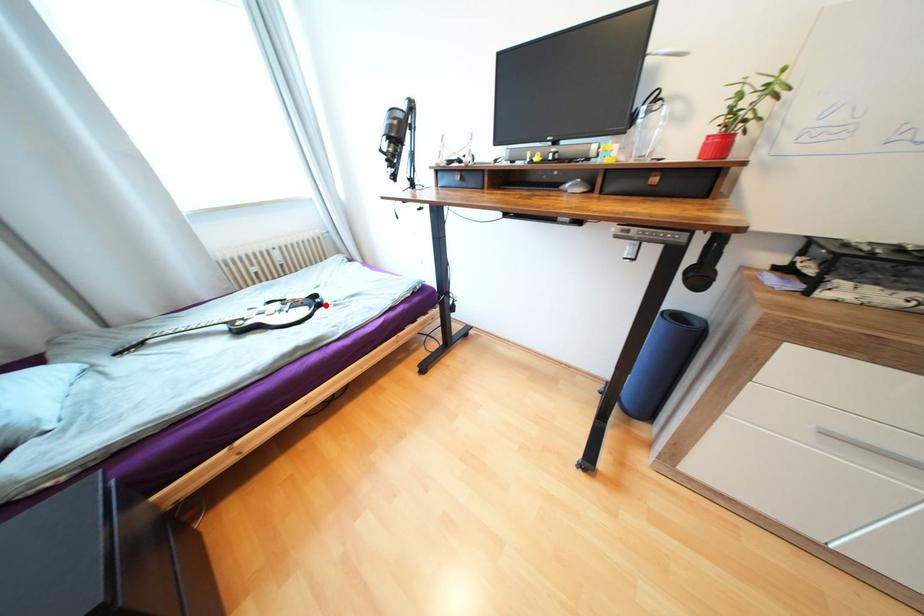
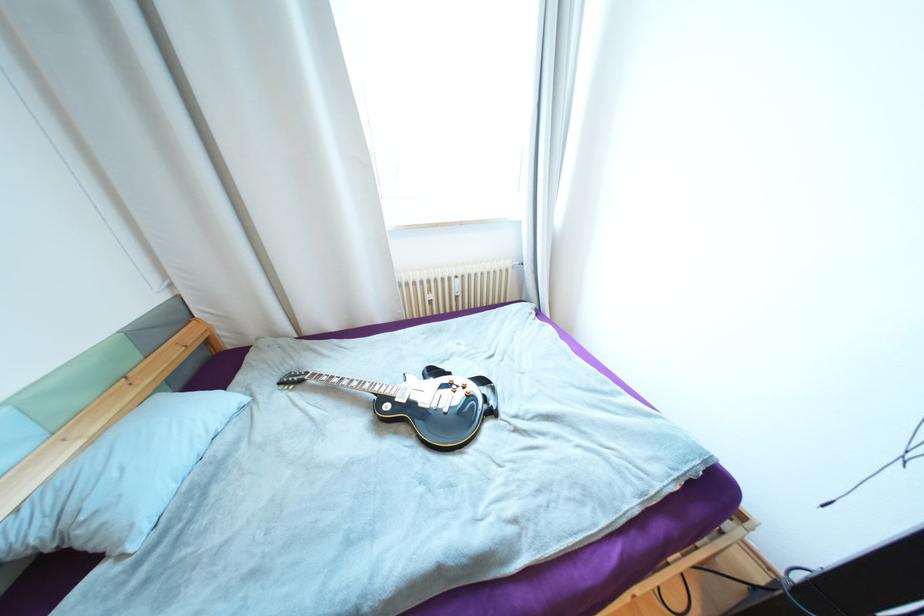
The point at the highlighted location is marked in the first image. Where is the corresponding point in the second image?

(497, 413)